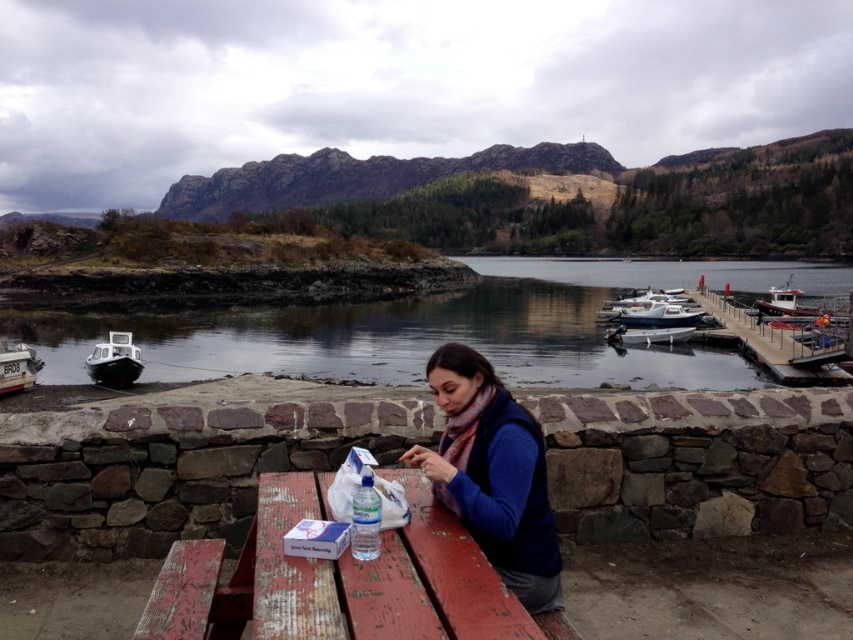
Question: Which of the following is the farthest from the observer?

Choices:
 (A) clear water at dock center
 (B) rusty wood table at center
 (C) white glossy boat at center right

Answer: (C)

Question: Which object is the farthest from the white plastic boat at center?

Choices:
 (A) blue fleece vest at center
 (B) white plastic boat at left
 (C) clear water at dock center

Answer: (A)

Question: Is clear water at dock center further to the viewer compared to white glossy boat at left?

Choices:
 (A) yes
 (B) no

Answer: (A)

Question: Does rusty wood table at center appear on the right side of white plastic boat at left?

Choices:
 (A) no
 (B) yes

Answer: (B)

Question: Among these objects, which one is farthest from the camera?

Choices:
 (A) white plastic boat at left
 (B) white glossy boat at center right
 (C) metallic silver boat at right

Answer: (B)

Question: Is blue fleece vest at center closer to the viewer compared to white glossy boat at center right?

Choices:
 (A) yes
 (B) no

Answer: (A)